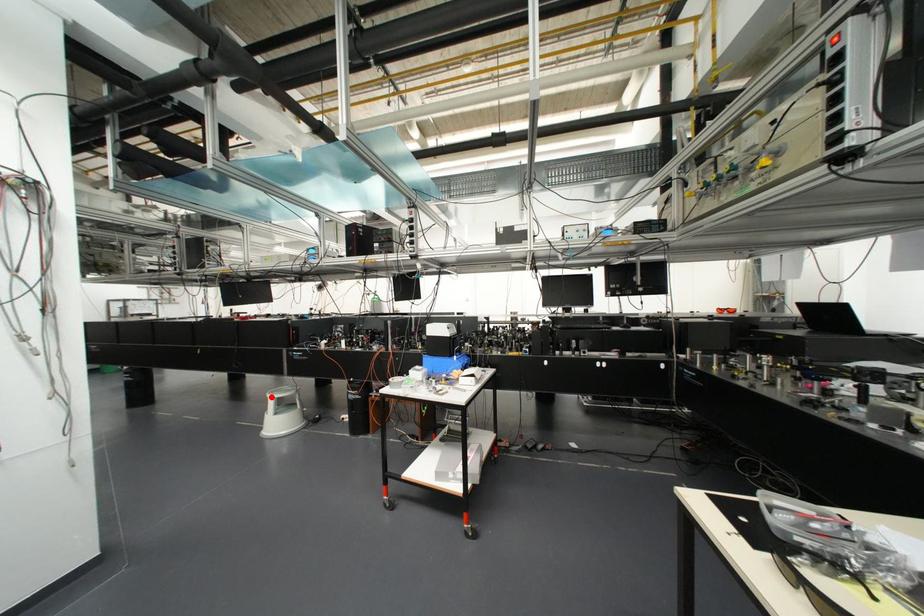
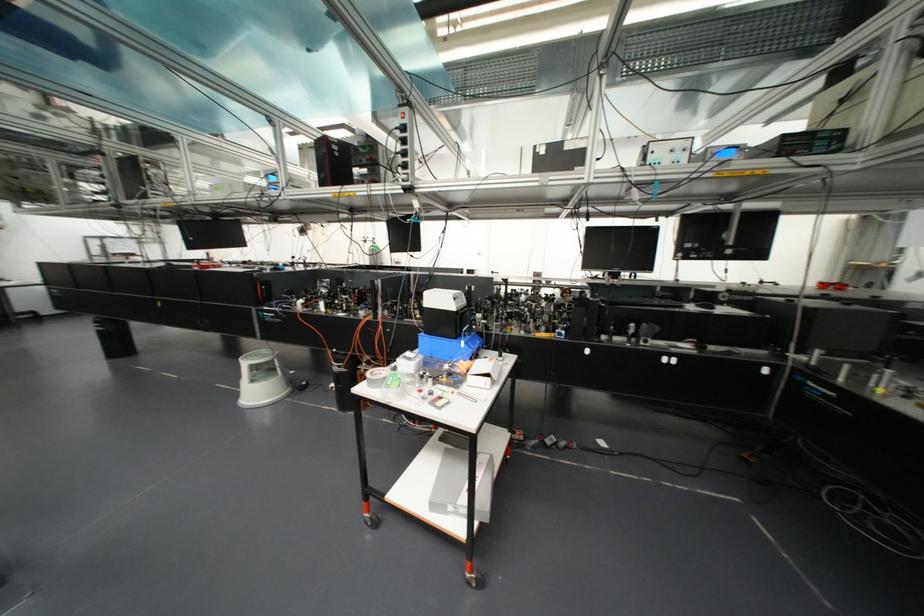
Question: I am providing you with two images of the same scene from different viewpoints. A red point is shown in image1. For the corresponding object point in image2, is it positioned nearer or farther from the camera?

Choices:
 (A) Nearer
 (B) Farther

Answer: (A)